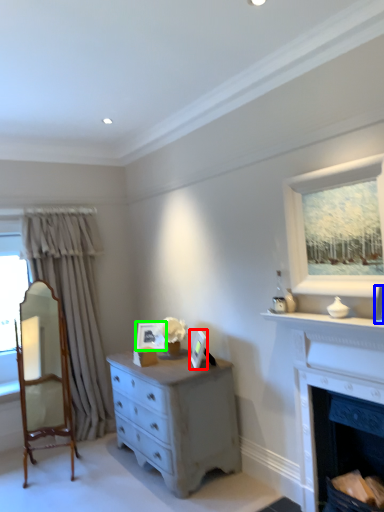
Question: Which object is the closest to the picture frame (highlighted by a red box)? Choose among these: picture frame (highlighted by a blue box) or picture frame (highlighted by a green box).

Choices:
 (A) picture frame
 (B) picture frame

Answer: (B)